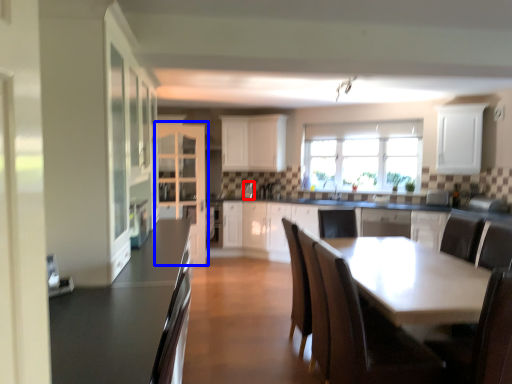
Question: Which object appears farthest to the camera in this image, appliance (highlighted by a red box) or cabinetry (highlighted by a blue box)?

Choices:
 (A) appliance
 (B) cabinetry

Answer: (A)